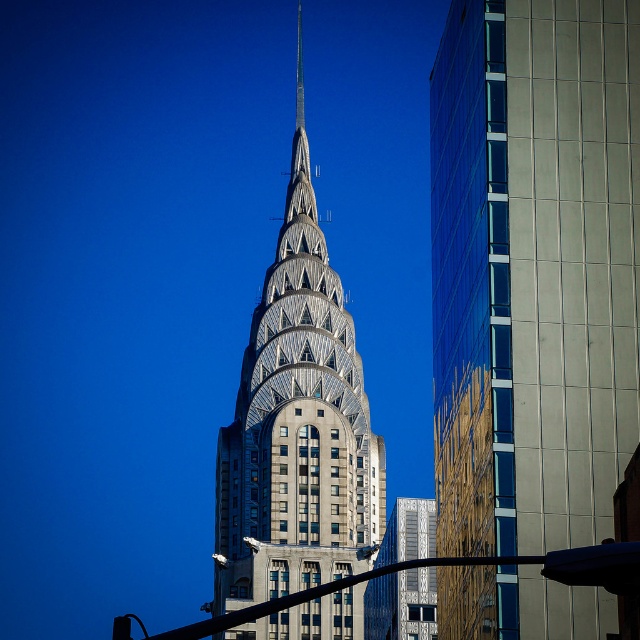
Question: In this image, where is silver metallic spire at center located relative to shiny silver spire at center?

Choices:
 (A) below
 (B) above

Answer: (A)

Question: Which object is the farthest from the silver metallic spire at center?

Choices:
 (A) shiny silver spire at center
 (B) reflective glass skyscraper at center

Answer: (A)

Question: Which point is closer to the camera?

Choices:
 (A) (349, 568)
 (B) (499, 292)
 (C) (298, 3)

Answer: (B)

Question: Which is nearer to the reflective glass skyscraper at center?

Choices:
 (A) shiny silver spire at center
 (B) silver metallic spire at center

Answer: (B)

Question: Can you confirm if silver metallic spire at center is bigger than shiny silver spire at center?

Choices:
 (A) no
 (B) yes

Answer: (B)

Question: Is reflective glass skyscraper at center to the right of shiny silver spire at center from the viewer's perspective?

Choices:
 (A) no
 (B) yes

Answer: (B)